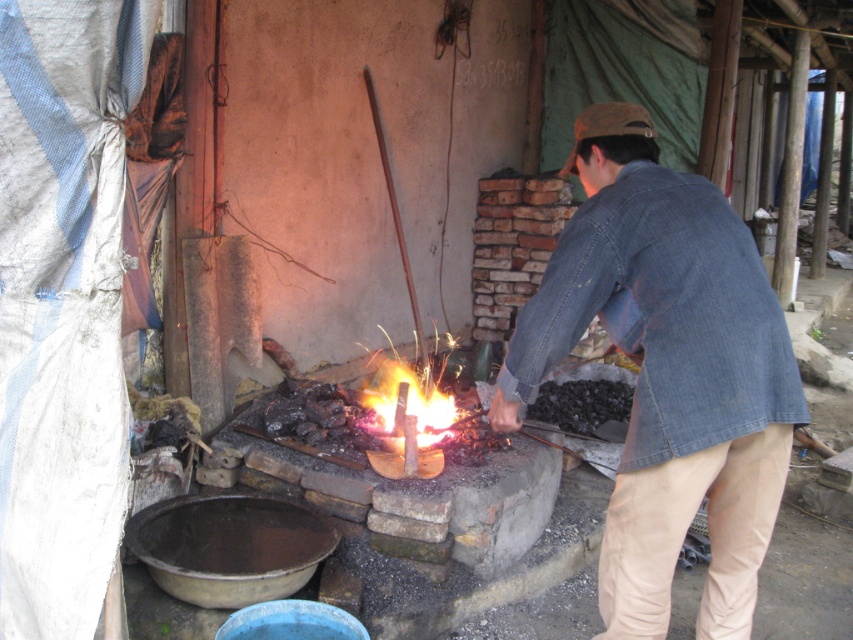
You are standing at the origin point of the coordinate system. The man in the denim jacket at center is working at a forge. Where would you find the point marked at coordinate (x=666, y=372) in relation to the denim jacket at center?

The point marked at coordinate (x=666, y=372) corresponds to the denim jacket at center.

You are a safety inspector visiting this workshop. You notice the denim jacket at center and the flaming hot steel at center. According to safety regulations, the minimum safe distance between flammable materials and open flames should be at least 2 meters. Is the current distance compliant with the regulation?

The denim jacket at center is only 1.33 meters away from the flaming hot steel at center, which is below the required 2 meters. This does not comply with safety regulations.